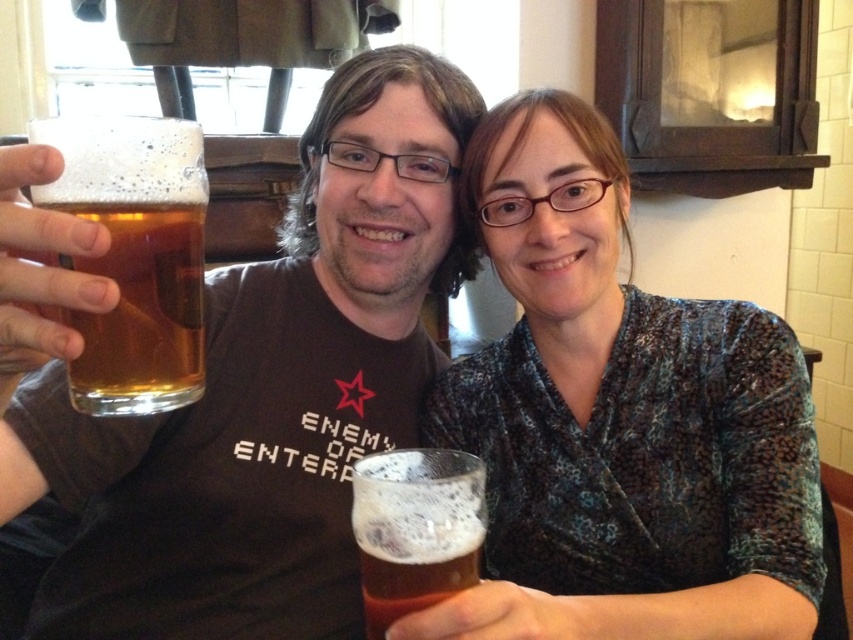
You are a bartender who needs to place a new drink order. You see the golden glass at left and the translucent glass at lower center. Which one is positioned more to the left side of the scene?

The golden glass at left is positioned more to the left side of the scene than the translucent glass at lower center.

You are standing in the room and want to place a small decorative item between the two points, point (x=84, y=259) and point (x=448, y=557). Which point should the item be closer to in order to be nearer to the viewer?

The item should be closer to point (x=84, y=259) because it is nearer to the viewer than point (x=448, y=557).